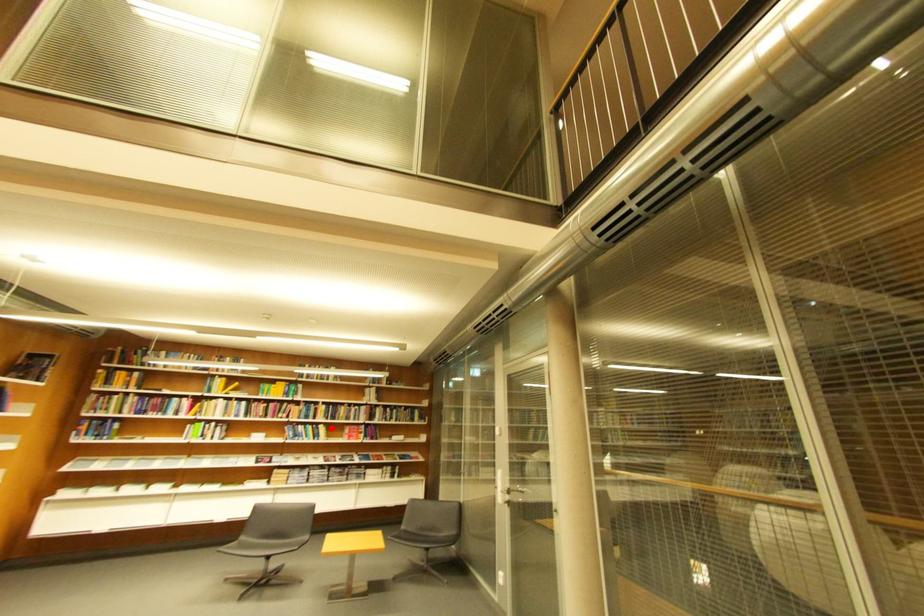
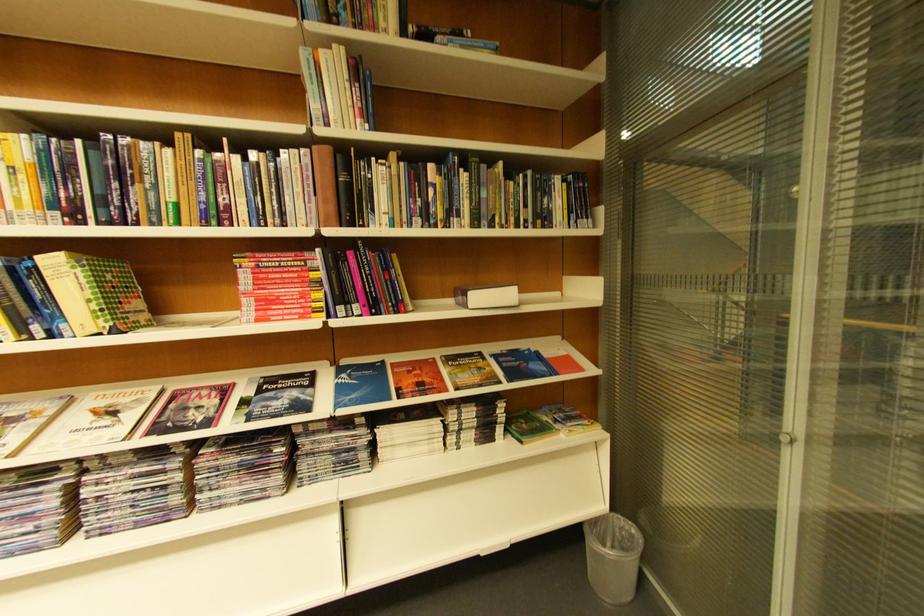
Find the pixel in the second image that matches the highlighted location in the first image.

(63, 264)